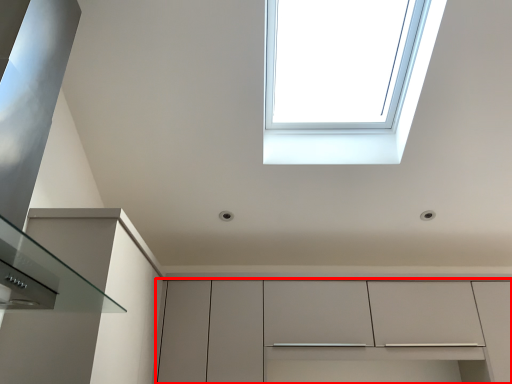
Question: From the image's perspective, what is the correct spatial relationship of cabinetry (annotated by the red box) in relation to window?

Choices:
 (A) below
 (B) above

Answer: (A)